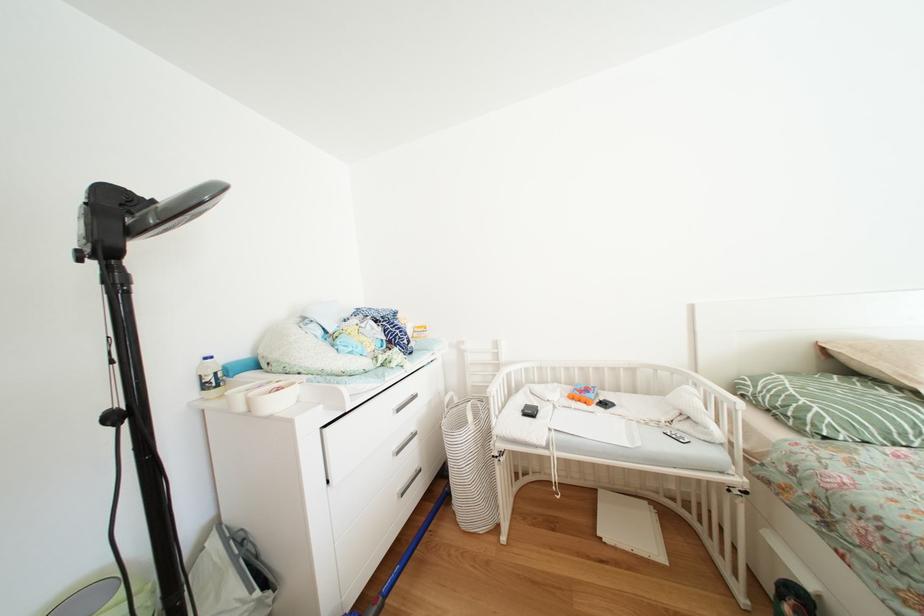
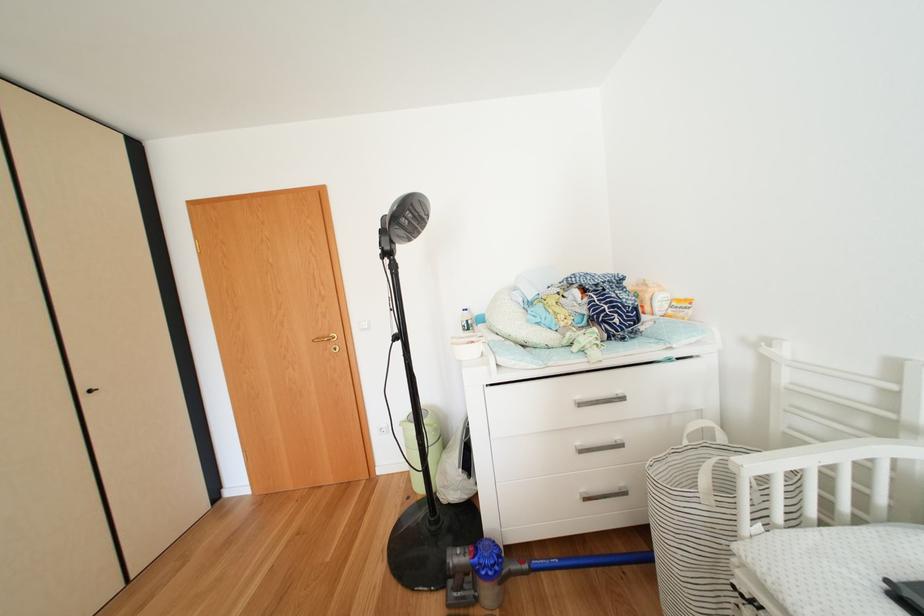
Find the pixel in the second image that matches pixel 405 453 in the first image.

(590, 448)